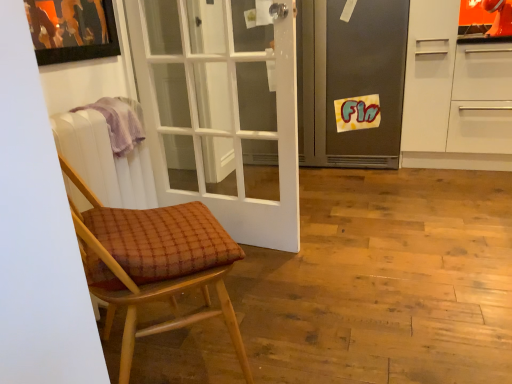
Question: From a real-world perspective, is brown woven cushion at left positioned under white plastic radiator at left based on gravity?

Choices:
 (A) yes
 (B) no

Answer: (A)

Question: Considering the relative positions of brown woven cushion at left and white plastic radiator at left in the image provided, is brown woven cushion at left to the left of white plastic radiator at left from the viewer's perspective?

Choices:
 (A) yes
 (B) no

Answer: (B)

Question: Is brown woven cushion at left not within white plastic radiator at left?

Choices:
 (A) yes
 (B) no

Answer: (A)

Question: Considering the relative sizes of brown woven cushion at left and white plastic radiator at left in the image provided, is brown woven cushion at left smaller than white plastic radiator at left?

Choices:
 (A) yes
 (B) no

Answer: (B)

Question: From the image's perspective, would you say brown woven cushion at left is positioned over white plastic radiator at left?

Choices:
 (A) no
 (B) yes

Answer: (A)

Question: Is white plastic radiator at left taller or shorter than metallic gray refrigerator at center?

Choices:
 (A) short
 (B) tall

Answer: (A)

Question: Does point (125, 168) appear closer or farther from the camera than point (359, 160)?

Choices:
 (A) farther
 (B) closer

Answer: (B)

Question: Considering the positions of white plastic radiator at left and metallic gray refrigerator at center in the image, is white plastic radiator at left bigger or smaller than metallic gray refrigerator at center?

Choices:
 (A) small
 (B) big

Answer: (A)

Question: From the image's perspective, is white plastic radiator at left positioned above or below metallic gray refrigerator at center?

Choices:
 (A) above
 (B) below

Answer: (B)

Question: Which is correct: white plastic radiator at left is inside purple cloth at left, or outside of it?

Choices:
 (A) inside
 (B) outside

Answer: (B)

Question: From the image's perspective, is white plastic radiator at left positioned above or below purple cloth at left?

Choices:
 (A) above
 (B) below

Answer: (B)

Question: Is white plastic radiator at left taller or shorter than purple cloth at left?

Choices:
 (A) short
 (B) tall

Answer: (B)

Question: From a real-world perspective, is white plastic radiator at left physically located above or below purple cloth at left?

Choices:
 (A) above
 (B) below

Answer: (B)

Question: From the image's perspective, is brown woven cushion at left above or below purple cloth at left?

Choices:
 (A) above
 (B) below

Answer: (B)

Question: In terms of size, does brown woven cushion at left appear bigger or smaller than purple cloth at left?

Choices:
 (A) big
 (B) small

Answer: (A)